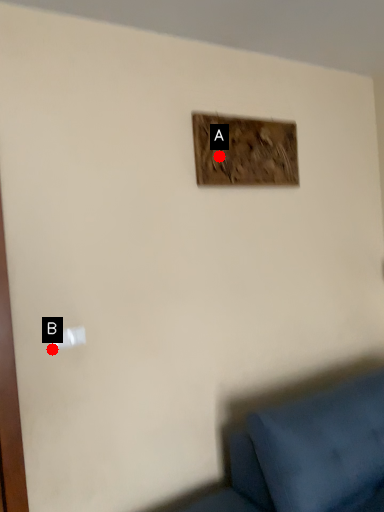
Question: Two points are circled on the image, labeled by A and B beside each circle. Which point is closer to the camera?

Choices:
 (A) A is closer
 (B) B is closer

Answer: (B)